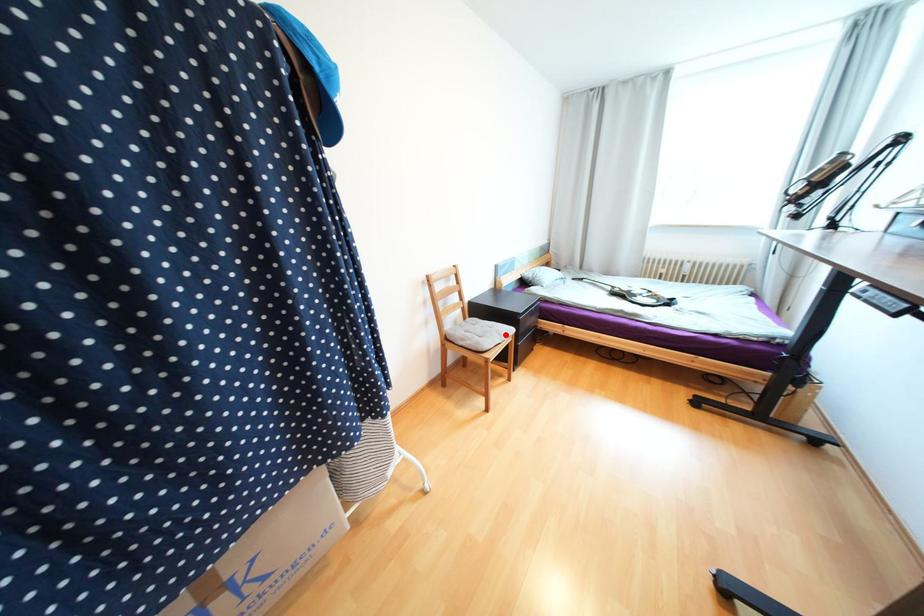
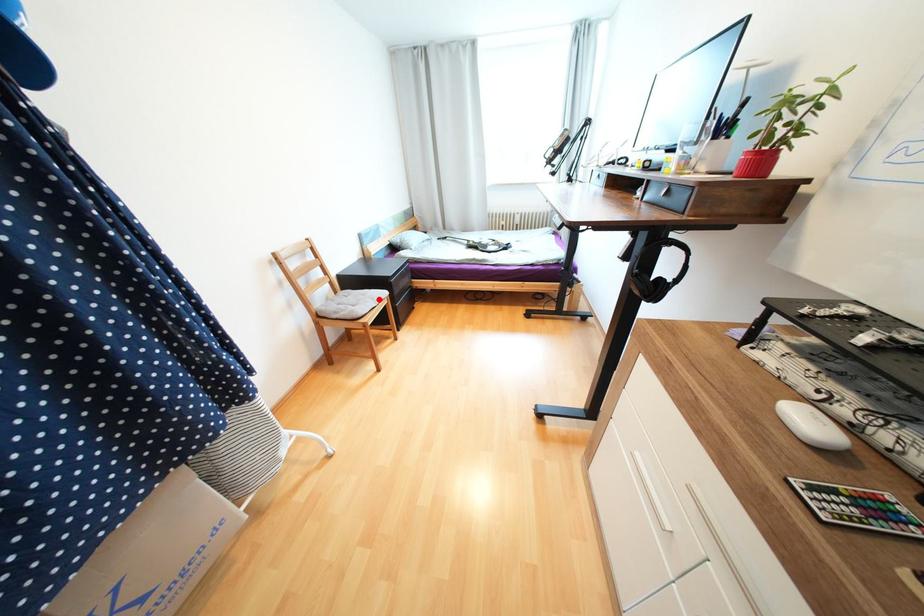
I am providing you with two images of the same scene from different viewpoints. A red point is marked on the first image and another point is marked on the second image. Is the marked point in image1 the same physical position as the marked point in image2?

Yes